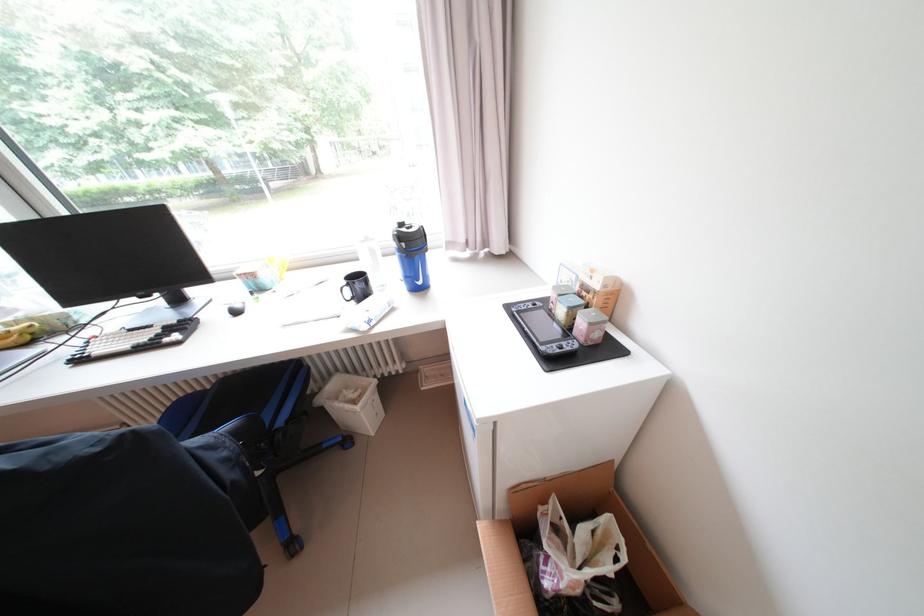
This screenshot has width=924, height=616. In order to click on small cardboard box in this screenshot , I will do `click(572, 541)`.